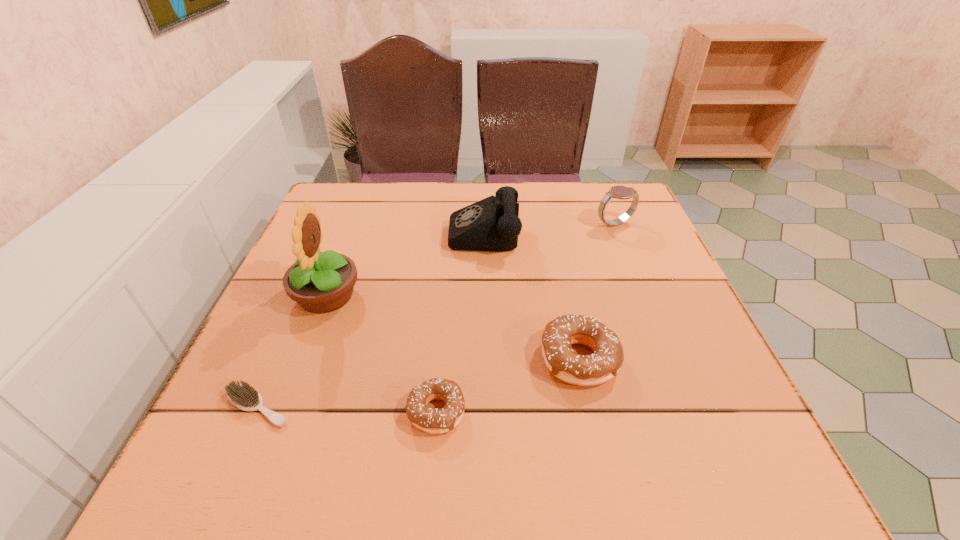
I want to click on scrubbing brush situated at the near edge, so click(243, 396).

The width and height of the screenshot is (960, 540). What are the coordinates of `sunflower that is at the left edge` in the screenshot? It's located at (320, 282).

This screenshot has width=960, height=540. Identify the location of scrubbing brush that is positioned at the left edge. (243, 396).

Image resolution: width=960 pixels, height=540 pixels. I want to click on object at the right edge, so click(620, 192).

Image resolution: width=960 pixels, height=540 pixels. I want to click on object at the near left corner, so click(x=243, y=396).

Image resolution: width=960 pixels, height=540 pixels. I want to click on object at the far right corner, so click(x=620, y=192).

Find the location of `free region at the far edge of the desktop`. free region at the far edge of the desktop is located at coordinates (442, 220).

The width and height of the screenshot is (960, 540). In the image, there is a desktop. In order to click on free space at the near edge in this screenshot , I will do `click(552, 389)`.

Locate an element on the screen. This screenshot has width=960, height=540. blank space at the left edge of the desktop is located at coordinates (285, 383).

Find the location of a particular element. The image size is (960, 540). blank space at the right edge of the desktop is located at coordinates (619, 282).